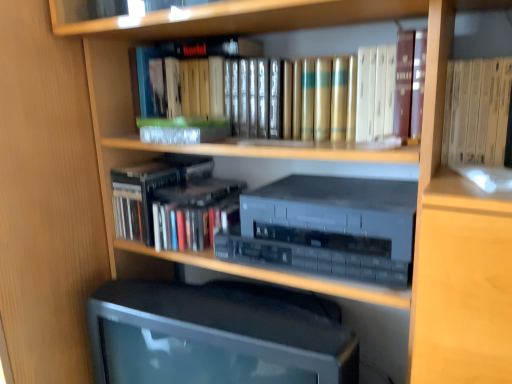
What is the approximate height of gold leather book at center, positioned as the second book in bottom-to-top order?

gold leather book at center, positioned as the second book in bottom-to-top order, is 8.61 inches in height.

Locate an element on the screen. Image resolution: width=512 pixels, height=384 pixels. satin silver stereo at center is located at coordinates (327, 228).

Image resolution: width=512 pixels, height=384 pixels. Identify the location of matte black monitor at center. (217, 335).

Where is `gold leather book at center, the first book viewed from the top`? The width and height of the screenshot is (512, 384). gold leather book at center, the first book viewed from the top is located at coordinates (389, 89).

Considering the points (213, 313) and (196, 246), which point is behind, point (213, 313) or point (196, 246)?

The point (196, 246) is behind.

Based on their sizes in the image, would you say matte black monitor at center is bigger or smaller than hardcover books at center, which appears as the first book when ordered from the bottom?

Clearly, matte black monitor at center is larger in size than hardcover books at center, which appears as the first book when ordered from the bottom.

From the image's perspective, is matte black monitor at center located above or below hardcover books at center, which ranks as the second book in top-to-bottom order?

Clearly, from the image's perspective, matte black monitor at center is below hardcover books at center, which ranks as the second book in top-to-bottom order.

Considering the positions of objects matte black monitor at center and hardcover books at center, which ranks as the second book in top-to-bottom order, in the image provided, who is more to the left, matte black monitor at center or hardcover books at center, which ranks as the second book in top-to-bottom order,?

hardcover books at center, which ranks as the second book in top-to-bottom order.

From the image's perspective, is matte black monitor at center located above satin silver stereo at center?

No, from the image's perspective, matte black monitor at center is not over satin silver stereo at center.

In the scene shown: From a real-world perspective, who is located lower, matte black monitor at center or satin silver stereo at center?

From a 3D spatial view, matte black monitor at center is below.

Does matte black monitor at center touch satin silver stereo at center?

No, matte black monitor at center is not beside satin silver stereo at center.

How many degrees apart are the facing directions of matte black monitor at center and satin silver stereo at center?

The angle between the facing direction of matte black monitor at center and the facing direction of satin silver stereo at center is 1.23 degrees.

Looking at this image, does hardcover books at center, which appears as the first book when ordered from the bottom, have a lesser width compared to satin silver stereo at center?

In fact, hardcover books at center, which appears as the first book when ordered from the bottom, might be wider than satin silver stereo at center.

From a real-world perspective, who is located higher, hardcover books at center, which ranks as the second book in top-to-bottom order, or satin silver stereo at center?

satin silver stereo at center is physically above.

Does hardcover books at center, which ranks as the second book in top-to-bottom order, come behind satin silver stereo at center?

Yes, it is behind satin silver stereo at center.

From the image's perspective, is satin silver stereo at center above or below hardcover books at center, which ranks as the second book in top-to-bottom order?

satin silver stereo at center is below hardcover books at center, which ranks as the second book in top-to-bottom order.

Consider the image. Do you think satin silver stereo at center is within hardcover books at center, which ranks as the second book in top-to-bottom order, or outside of it?

satin silver stereo at center is located beyond the bounds of hardcover books at center, which ranks as the second book in top-to-bottom order.

What's the angular difference between satin silver stereo at center and hardcover books at center, which ranks as the second book in top-to-bottom order,'s facing directions?

The angular difference between satin silver stereo at center and hardcover books at center, which ranks as the second book in top-to-bottom order, is 1.08 degrees.

Between satin silver stereo at center and hardcover books at center, which ranks as the second book in top-to-bottom order, which one has smaller width?

Thinner between the two is satin silver stereo at center.

Considering the positions of points (373, 216) and (379, 123), is point (373, 216) closer to camera compared to point (379, 123)?

Yes, it is.

Can you confirm if satin silver stereo at center is thinner than gold leather book at center, positioned as the second book in bottom-to-top order?

Incorrect, the width of satin silver stereo at center is not less than that of gold leather book at center, positioned as the second book in bottom-to-top order.

Is satin silver stereo at center not within gold leather book at center, the first book viewed from the top?

Indeed, satin silver stereo at center is completely outside gold leather book at center, the first book viewed from the top.

Are satin silver stereo at center and gold leather book at center, the first book viewed from the top, located far from each other?

No, satin silver stereo at center is in close proximity to gold leather book at center, the first book viewed from the top.

Is hardcover books at center, which ranks as the second book in top-to-bottom order, oriented towards gold leather book at center, positioned as the second book in bottom-to-top order?

No, hardcover books at center, which ranks as the second book in top-to-bottom order, does not turn towards gold leather book at center, positioned as the second book in bottom-to-top order.

Considering the positions of objects hardcover books at center, which appears as the first book when ordered from the bottom, and gold leather book at center, positioned as the second book in bottom-to-top order, in the image provided, who is more to the left, hardcover books at center, which appears as the first book when ordered from the bottom, or gold leather book at center, positioned as the second book in bottom-to-top order,?

From the viewer's perspective, hardcover books at center, which appears as the first book when ordered from the bottom, appears more on the left side.

Can you confirm if hardcover books at center, which ranks as the second book in top-to-bottom order, is taller than gold leather book at center, the first book viewed from the top?

Incorrect, the height of hardcover books at center, which ranks as the second book in top-to-bottom order, is not larger of that of gold leather book at center, the first book viewed from the top.

From the picture: Is hardcover books at center, which appears as the first book when ordered from the bottom, beside gold leather book at center, positioned as the second book in bottom-to-top order?

No, hardcover books at center, which appears as the first book when ordered from the bottom, is not beside gold leather book at center, positioned as the second book in bottom-to-top order.

Considering the positions of point (217, 318) and point (284, 91), is point (217, 318) closer or farther from the camera than point (284, 91)?

Point (217, 318) is closer to the camera than point (284, 91).

From a real-world perspective, relative to gold leather book at center, the first book viewed from the top, is matte black monitor at center vertically above or below?

From a real-world perspective, matte black monitor at center is physically below gold leather book at center, the first book viewed from the top.

Can you confirm if matte black monitor at center is taller than gold leather book at center, the first book viewed from the top?

Correct, matte black monitor at center is much taller as gold leather book at center, the first book viewed from the top.

Consider the image. Considering the positions of objects matte black monitor at center and gold leather book at center, positioned as the second book in bottom-to-top order, in the image provided, who is more to the right, matte black monitor at center or gold leather book at center, positioned as the second book in bottom-to-top order,?

gold leather book at center, positioned as the second book in bottom-to-top order.

Identify the location of book on the left of matte black monitor at center. This screenshot has width=512, height=384. (173, 202).

The width and height of the screenshot is (512, 384). Find the location of `computer monitor in front of the satin silver stereo at center`. computer monitor in front of the satin silver stereo at center is located at coordinates (217, 335).

Looking at the image, which one is located closer to matte black monitor at center, hardcover books at center, which ranks as the second book in top-to-bottom order, or gold leather book at center, positioned as the second book in bottom-to-top order?

hardcover books at center, which ranks as the second book in top-to-bottom order, is closer to matte black monitor at center.

Which object lies nearer to the anchor point hardcover books at center, which appears as the first book when ordered from the bottom, satin silver stereo at center or matte black monitor at center?

satin silver stereo at center.

Considering their positions, is matte black monitor at center positioned further to hardcover books at center, which ranks as the second book in top-to-bottom order, than gold leather book at center, positioned as the second book in bottom-to-top order?

Based on the image, gold leather book at center, positioned as the second book in bottom-to-top order, appears to be further to hardcover books at center, which ranks as the second book in top-to-bottom order.

Based on their spatial positions, is matte black monitor at center or gold leather book at center, the first book viewed from the top, further from satin silver stereo at center?

The object further to satin silver stereo at center is gold leather book at center, the first book viewed from the top.

Estimate the real-world distances between objects in this image. Which object is further from satin silver stereo at center, gold leather book at center, the first book viewed from the top, or hardcover books at center, which ranks as the second book in top-to-bottom order?

hardcover books at center, which ranks as the second book in top-to-bottom order, lies further to satin silver stereo at center than the other object.

Based on their spatial positions, is gold leather book at center, positioned as the second book in bottom-to-top order, or hardcover books at center, which appears as the first book when ordered from the bottom, closer to matte black monitor at center?

Among the two, hardcover books at center, which appears as the first book when ordered from the bottom, is located nearer to matte black monitor at center.

Considering their positions, is satin silver stereo at center positioned closer to gold leather book at center, positioned as the second book in bottom-to-top order, than matte black monitor at center?

The object closer to gold leather book at center, positioned as the second book in bottom-to-top order, is satin silver stereo at center.

Consider the image. Estimate the real-world distances between objects in this image. Which object is further from hardcover books at center, which ranks as the second book in top-to-bottom order, matte black monitor at center or satin silver stereo at center?

Based on the image, matte black monitor at center appears to be further to hardcover books at center, which ranks as the second book in top-to-bottom order.

Image resolution: width=512 pixels, height=384 pixels. Find the location of `book between gold leather book at center, positioned as the second book in bottom-to-top order, and matte black monitor at center from top to bottom`. book between gold leather book at center, positioned as the second book in bottom-to-top order, and matte black monitor at center from top to bottom is located at coordinates (173, 202).

The image size is (512, 384). Identify the location of stereo between gold leather book at center, the first book viewed from the top, and matte black monitor at center from top to bottom. (327, 228).

Image resolution: width=512 pixels, height=384 pixels. I want to click on book between hardcover books at center, which appears as the first book when ordered from the bottom, and satin silver stereo at center, so click(389, 89).

The image size is (512, 384). Find the location of `stereo between hardcover books at center, which ranks as the second book in top-to-bottom order, and matte black monitor at center, in the vertical direction`. stereo between hardcover books at center, which ranks as the second book in top-to-bottom order, and matte black monitor at center, in the vertical direction is located at coordinates (327, 228).